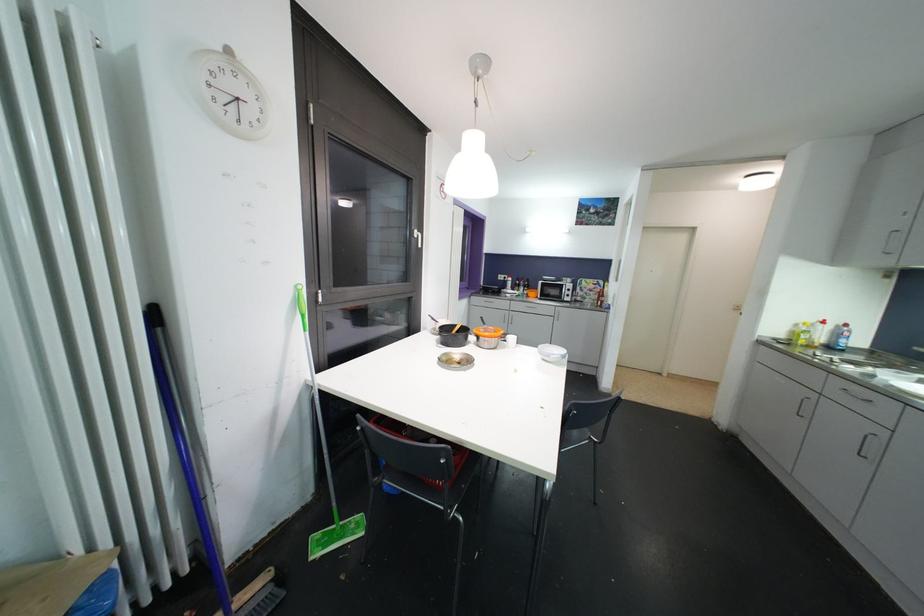
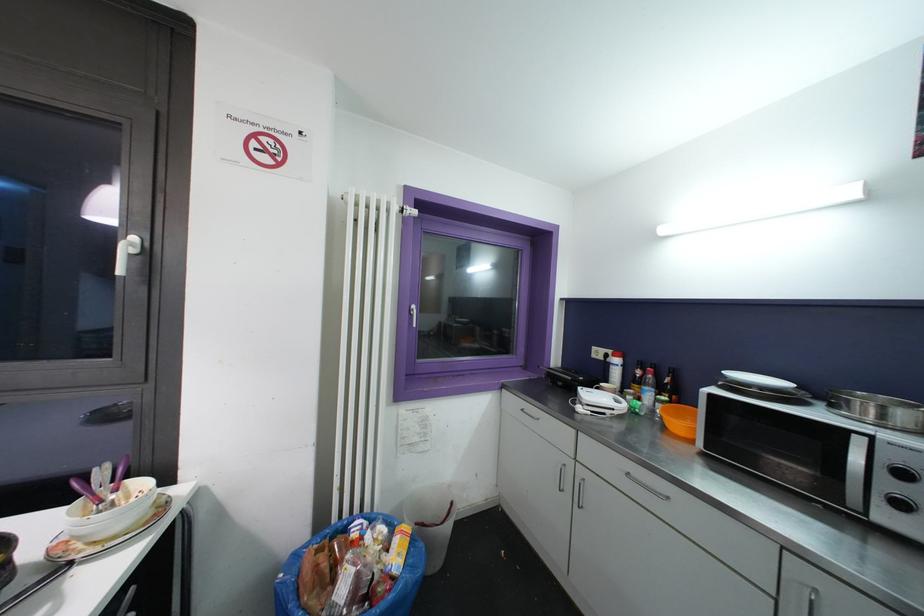
The point at (528, 289) is marked in the first image. Where is the corresponding point in the second image?

(663, 392)